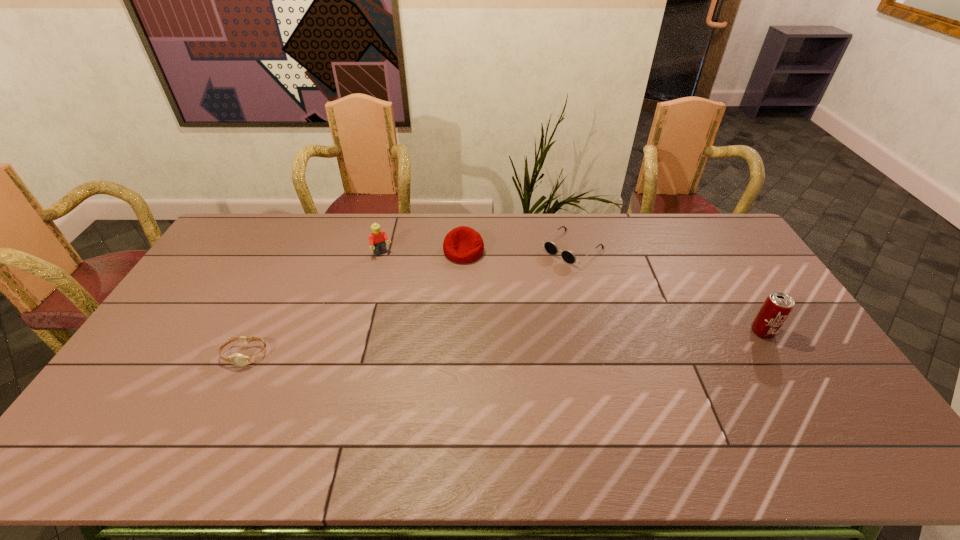
Locate which object is the closest to the beer can. Please provide its 2D coordinates. Your answer should be formatted as a tuple, i.e. [(x, y)], where the tuple contains the x and y coordinates of a point satisfying the conditions above.

[(568, 256)]